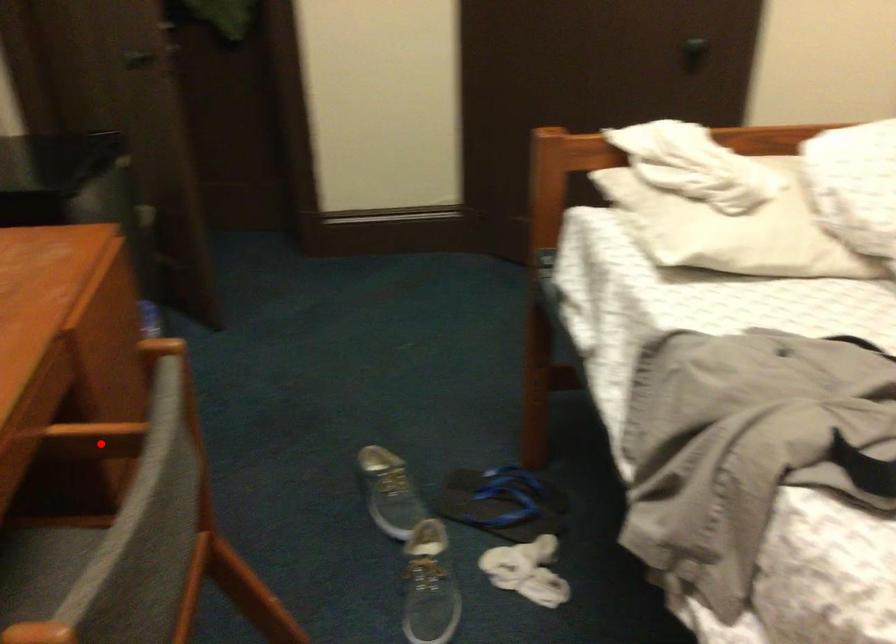
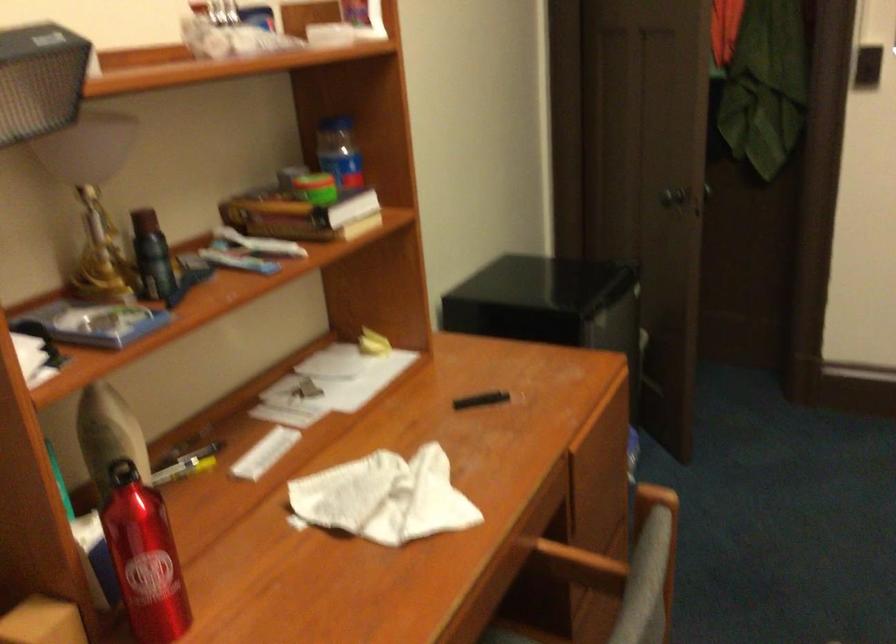
Find the pixel in the second image that matches the highlighted location in the first image.

(579, 565)